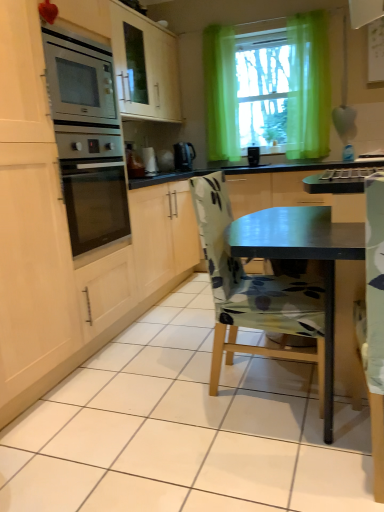
Question: Is green sheer curtain at upper center taller than floral fabric chair at center?

Choices:
 (A) yes
 (B) no

Answer: (A)

Question: Would you say green sheer curtain at upper center is outside floral fabric chair at center?

Choices:
 (A) yes
 (B) no

Answer: (A)

Question: Is green sheer curtain at upper center positioned far away from floral fabric chair at center?

Choices:
 (A) no
 (B) yes

Answer: (B)

Question: From the image's perspective, is green sheer curtain at upper center beneath floral fabric chair at center?

Choices:
 (A) no
 (B) yes

Answer: (A)

Question: Is green sheer curtain at upper center placed right next to floral fabric chair at center?

Choices:
 (A) no
 (B) yes

Answer: (A)

Question: Does green sheer curtain at upper center lie behind floral fabric chair at center?

Choices:
 (A) no
 (B) yes

Answer: (B)

Question: Does green sheer curtain at upper center have a greater width compared to white glossy kettle at center?

Choices:
 (A) yes
 (B) no

Answer: (A)

Question: Is white glossy kettle at center completely or partially inside green sheer curtain at upper center?

Choices:
 (A) no
 (B) yes

Answer: (A)

Question: Is green sheer curtain at upper center in contact with white glossy kettle at center?

Choices:
 (A) no
 (B) yes

Answer: (A)

Question: Is the depth of green sheer curtain at upper center greater than that of white glossy kettle at center?

Choices:
 (A) yes
 (B) no

Answer: (B)

Question: Is green sheer curtain at upper center taller than white glossy kettle at center?

Choices:
 (A) no
 (B) yes

Answer: (B)

Question: Does green sheer curtain at upper center come in front of white glossy kettle at center?

Choices:
 (A) yes
 (B) no

Answer: (A)

Question: Is black plastic kettle at center wider than white glossy kettle at center?

Choices:
 (A) no
 (B) yes

Answer: (B)